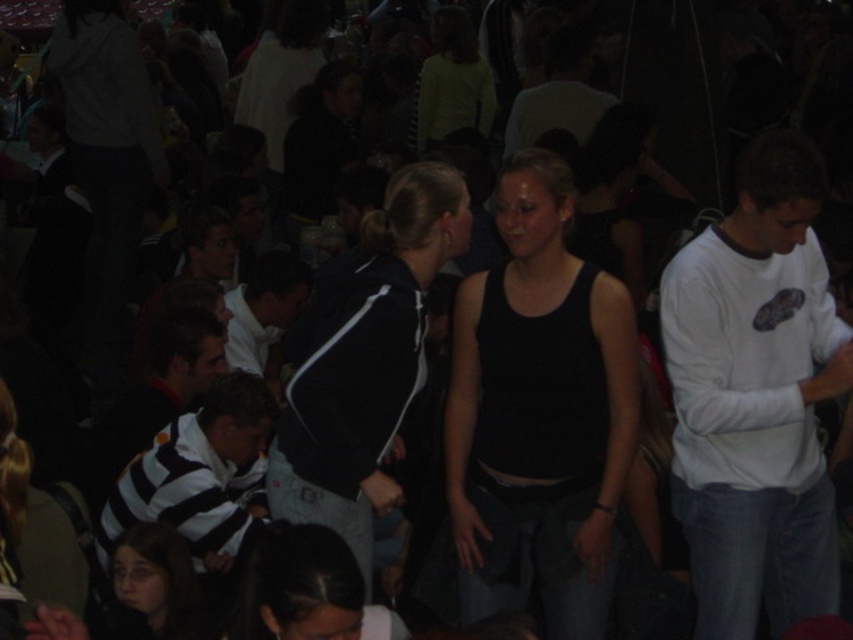
You are standing in the crowd and want to move from point A to point B. Point A is at coordinates point (592, 588) and point B is at coordinates point (161, 580). Since you can only move forward, will you be able to reach point B without moving sideways?

Point (592, 588) is further to the viewer than point (161, 580). Since you can only move forward, you cannot reach point B from point A without moving sideways because point B is behind point A relative to your position.

You are at a party and want to introduce yourself to the person with dark brown hair at lower left. To approach them, you need to walk past the white striped shirt at center. Is there enough space between them to walk through?

The dark brown hair at lower left is positioned under the white striped shirt at center, so there is no vertical space between them to walk through. You would need to find another path.